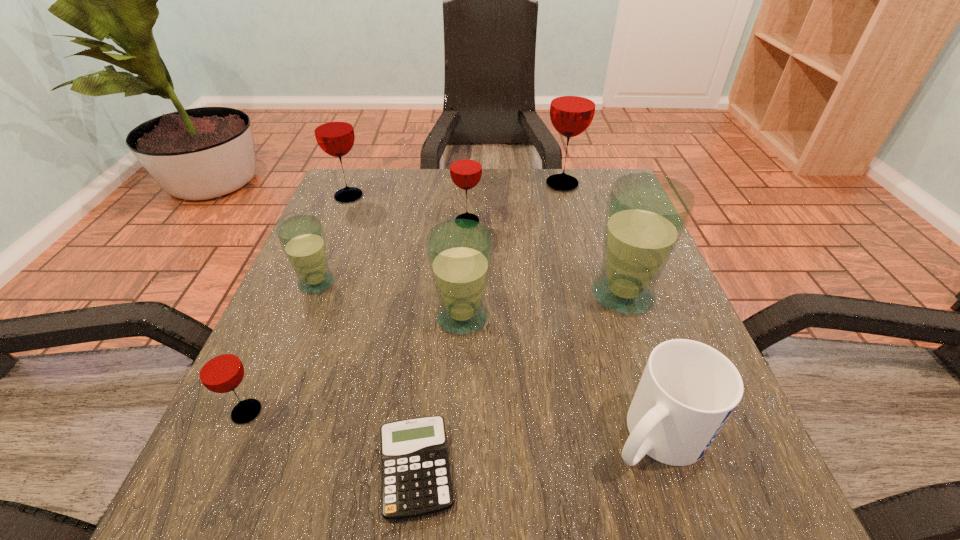
Locate an element on the screen. Image resolution: width=960 pixels, height=540 pixels. blue mug is located at coordinates (688, 390).

In order to click on calculator in this screenshot , I will do `click(416, 481)`.

The image size is (960, 540). Identify the location of vacant space located 0.170m on the front of the tallest object. (576, 235).

Image resolution: width=960 pixels, height=540 pixels. Identify the location of free space located on the front of the third smallest red glass. (338, 222).

Where is `vacant area situated 0.320m on the back of the biggest blue glass`? This screenshot has width=960, height=540. vacant area situated 0.320m on the back of the biggest blue glass is located at coordinates (587, 190).

Where is `free location located 0.240m on the front of the second nearest red glass`? free location located 0.240m on the front of the second nearest red glass is located at coordinates (464, 307).

Find the location of `vacant region located on the right of the second smallest blue glass`. vacant region located on the right of the second smallest blue glass is located at coordinates (547, 317).

The image size is (960, 540). Find the location of `vacant space located on the back of the leftmost blue glass`. vacant space located on the back of the leftmost blue glass is located at coordinates (339, 229).

Find the location of a particular element. blank space located on the right of the nearest glass is located at coordinates (420, 412).

You are a GUI agent. You are given a task and a screenshot of the screen. Output one action in this format:
    pyautogui.click(x=<x>, y=<y>)
    Task: Click on the blank space located 0.280m on the left of the blue mug
    
    Given the screenshot: What is the action you would take?
    pyautogui.click(x=409, y=435)